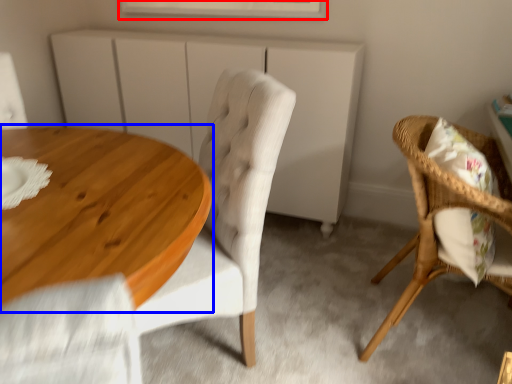
Question: Which point is closer to the camera, window (highlighted by a red box) or coffee table (highlighted by a blue box)?

Choices:
 (A) window
 (B) coffee table

Answer: (B)